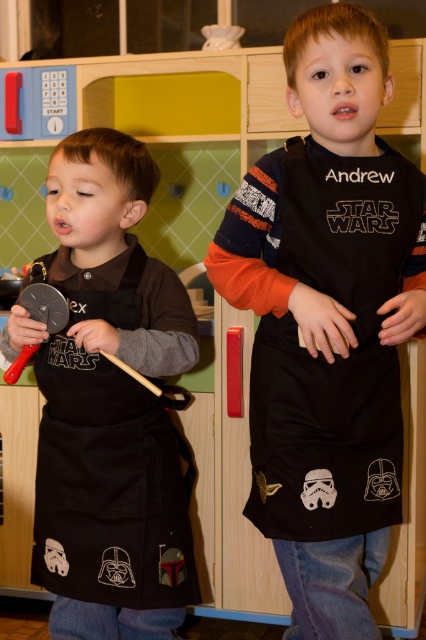
Question: Is black fabric apron at center positioned at the back of black matte apron at left?

Choices:
 (A) yes
 (B) no

Answer: (B)

Question: Which point is closer to the camera taking this photo?

Choices:
 (A) (259, 376)
 (B) (92, 608)

Answer: (A)

Question: Does black fabric apron at center appear on the right side of black matte apron at left?

Choices:
 (A) yes
 (B) no

Answer: (A)

Question: Which of the following is the farthest from the observer?

Choices:
 (A) black fabric apron at center
 (B) black matte apron at left

Answer: (B)

Question: Is black fabric apron at center to the right of black matte apron at left from the viewer's perspective?

Choices:
 (A) no
 (B) yes

Answer: (B)